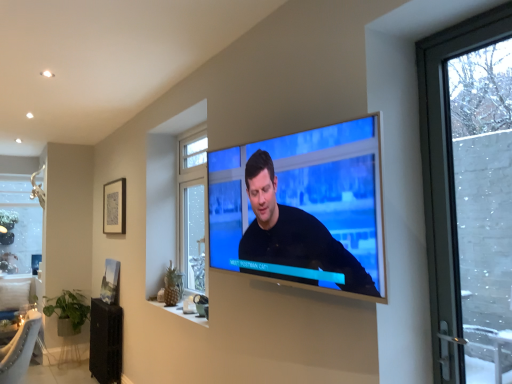
The height and width of the screenshot is (384, 512). What do you see at coordinates (110, 282) in the screenshot?
I see `matte black picture frame at lower left, which is the second picture frame from top to bottom` at bounding box center [110, 282].

Locate an element on the screen. Image resolution: width=512 pixels, height=384 pixels. clear glass window at upper left, which appears as the first window when viewed from the left is located at coordinates (19, 225).

Identify the location of matte black tv at center. The width and height of the screenshot is (512, 384). (302, 209).

What do you see at coordinates (114, 207) in the screenshot?
I see `matte black picture frame at upper left, which appears as the 2th picture frame when ordered from the bottom` at bounding box center [114, 207].

Identify the location of clear glass window at center, which is counted as the first window, starting from the front. (192, 209).

Can you confirm if clear glass window at upper left, which appears as the first window when viewed from the left, is shorter than matte black picture frame at lower left, which is the second picture frame from top to bottom?

Result: No.

Is matte black picture frame at lower left, which is the second picture frame from top to bottom, completely or partially inside clear glass window at upper left, which ranks as the 2th window in right-to-left order?

No, matte black picture frame at lower left, which is the second picture frame from top to bottom, is not inside clear glass window at upper left, which ranks as the 2th window in right-to-left order.

Is clear glass window at upper left, the first window when ordered from back to front, placed right next to matte black picture frame at lower left, which is the second picture frame from top to bottom?

clear glass window at upper left, the first window when ordered from back to front, is not next to matte black picture frame at lower left, which is the second picture frame from top to bottom, and they're not touching.

Where is `picture frame lying below the clear glass window at upper left, the 2th window from the front (from the image's perspective)`? Image resolution: width=512 pixels, height=384 pixels. picture frame lying below the clear glass window at upper left, the 2th window from the front (from the image's perspective) is located at coordinates (110, 282).

This screenshot has width=512, height=384. Identify the location of window on the left of the matte black picture frame at upper left, which is the 1th picture frame from top to bottom. (19, 225).

What's the angular difference between clear glass window at upper left, which ranks as the 2th window in right-to-left order, and matte black picture frame at upper left, which appears as the 2th picture frame when ordered from the bottom,'s facing directions?

The angle between the facing direction of clear glass window at upper left, which ranks as the 2th window in right-to-left order, and the facing direction of matte black picture frame at upper left, which appears as the 2th picture frame when ordered from the bottom, is 89.2 degrees.

From the picture: Is clear glass window at upper left, the 2th window from the front, at the right side of matte black picture frame at upper left, which appears as the 2th picture frame when ordered from the bottom?

Incorrect, clear glass window at upper left, the 2th window from the front, is not on the right side of matte black picture frame at upper left, which appears as the 2th picture frame when ordered from the bottom.

Considering the sizes of clear glass window at upper left, which ranks as the 2th window in right-to-left order, and matte black picture frame at upper left, which is the 1th picture frame from top to bottom, in the image, is clear glass window at upper left, which ranks as the 2th window in right-to-left order, wider or thinner than matte black picture frame at upper left, which is the 1th picture frame from top to bottom,?

clear glass window at upper left, which ranks as the 2th window in right-to-left order, is wider than matte black picture frame at upper left, which is the 1th picture frame from top to bottom.

Which is nearer, (22, 257) or (194, 215)?

Point (22, 257).

Is clear glass window at upper left, the first window when ordered from back to front, wider than clear glass window at center, which is counted as the first window, starting from the front?

No, clear glass window at upper left, the first window when ordered from back to front, is not wider than clear glass window at center, which is counted as the first window, starting from the front.

The width and height of the screenshot is (512, 384). I want to click on window lying in front of the clear glass window at upper left, the first window when ordered from back to front, so click(192, 209).

Is clear glass window at upper left, the 2th window from the front, facing away from clear glass window at center, marked as the 1th window in a right-to-left arrangement?

No, clear glass window at upper left, the 2th window from the front, is not facing the opposite direction of clear glass window at center, marked as the 1th window in a right-to-left arrangement.

Is clear glass window at center, marked as the 1th window in a right-to-left arrangement, positioned far away from clear glass window at upper left, which appears as the first window when viewed from the left?

clear glass window at center, marked as the 1th window in a right-to-left arrangement, is positioned a significant distance from clear glass window at upper left, which appears as the first window when viewed from the left.

Which is farther, (182, 163) or (33, 203)?

Point (33, 203)

From the image's perspective, is clear glass window at center, which is counted as the first window, starting from the front, located above or below clear glass window at upper left, which ranks as the 2th window in right-to-left order?

Based on their image positions, clear glass window at center, which is counted as the first window, starting from the front, is located above clear glass window at upper left, which ranks as the 2th window in right-to-left order.

Is clear glass window at center, positioned as the second window in back-to-front order, not inside clear glass window at upper left, the first window when ordered from back to front?

Yes.

From the image's perspective, is matte black picture frame at upper left, which is the 1th picture frame from top to bottom, located above or below clear glass window at upper left, the 2th window from the front?

matte black picture frame at upper left, which is the 1th picture frame from top to bottom, is situated higher than clear glass window at upper left, the 2th window from the front, in the image.

Which is more to the right, matte black picture frame at upper left, which appears as the 2th picture frame when ordered from the bottom, or clear glass window at upper left, which appears as the first window when viewed from the left?

Positioned to the right is matte black picture frame at upper left, which appears as the 2th picture frame when ordered from the bottom.

From a real-world perspective, which is physically above, matte black picture frame at upper left, which appears as the 2th picture frame when ordered from the bottom, or clear glass window at upper left, the 2th window from the front?

From a 3D spatial view, matte black picture frame at upper left, which appears as the 2th picture frame when ordered from the bottom, is above.

Measure the distance from matte black picture frame at upper left, which is the 1th picture frame from top to bottom, to clear glass window at upper left, the 2th window from the front.

The distance of matte black picture frame at upper left, which is the 1th picture frame from top to bottom, from clear glass window at upper left, the 2th window from the front, is 3.97 meters.

Can you confirm if matte black tv at center is thinner than matte black picture frame at lower left, which is the second picture frame from top to bottom?

Incorrect, the width of matte black tv at center is not less than that of matte black picture frame at lower left, which is the second picture frame from top to bottom.

Considering the relative sizes of matte black tv at center and matte black picture frame at lower left, which ranks as the 1th picture frame in bottom-to-top order, in the image provided, is matte black tv at center taller than matte black picture frame at lower left, which ranks as the 1th picture frame in bottom-to-top order,?

Yes.

Consider the image. From the image's perspective, is matte black tv at center located beneath matte black picture frame at lower left, which is the second picture frame from top to bottom?

No, from the image's perspective, matte black tv at center is not below matte black picture frame at lower left, which is the second picture frame from top to bottom.

Considering the positions of point (379, 173) and point (116, 297), is point (379, 173) closer or farther from the camera than point (116, 297)?

Point (379, 173).

Considering the sizes of objects matte black picture frame at lower left, which is the second picture frame from top to bottom, and clear glass window at center, which ranks as the 2th window in left-to-right order, in the image provided, who is bigger, matte black picture frame at lower left, which is the second picture frame from top to bottom, or clear glass window at center, which ranks as the 2th window in left-to-right order,?

clear glass window at center, which ranks as the 2th window in left-to-right order.

Considering the positions of points (115, 264) and (178, 251), is point (115, 264) farther from camera compared to point (178, 251)?

Yes, it is behind point (178, 251).

Choose the correct answer: Is matte black picture frame at lower left, which is the second picture frame from top to bottom, inside clear glass window at center, marked as the 1th window in a right-to-left arrangement, or outside it?

matte black picture frame at lower left, which is the second picture frame from top to bottom, is not inside clear glass window at center, marked as the 1th window in a right-to-left arrangement, it's outside.

Between matte black picture frame at lower left, which ranks as the 1th picture frame in bottom-to-top order, and clear glass window at center, marked as the 1th window in a right-to-left arrangement, which one is positioned behind?

matte black picture frame at lower left, which ranks as the 1th picture frame in bottom-to-top order, is behind.

From a real-world perspective, which window is the 1st one above the matte black picture frame at lower left, which ranks as the 1th picture frame in bottom-to-top order? Please provide its 2D coordinates.

[(19, 225)]

Locate an element on the screen. The height and width of the screenshot is (384, 512). the 2nd window located beneath the matte black picture frame at upper left, which is the 1th picture frame from top to bottom (from a real-world perspective) is located at coordinates (19, 225).

From the image, which object appears to be farther from matte black picture frame at lower left, which ranks as the 1th picture frame in bottom-to-top order, matte black picture frame at upper left, which is the 1th picture frame from top to bottom, or clear glass window at center, which ranks as the 2th window in left-to-right order?

Based on the image, clear glass window at center, which ranks as the 2th window in left-to-right order, appears to be further to matte black picture frame at lower left, which ranks as the 1th picture frame in bottom-to-top order.

When comparing their distances from matte black picture frame at upper left, which appears as the 2th picture frame when ordered from the bottom, does clear glass window at upper left, the 2th window from the front, or matte black picture frame at lower left, which is the second picture frame from top to bottom, seem further?

clear glass window at upper left, the 2th window from the front.

Which object lies nearer to the anchor point clear glass window at center, positioned as the second window in back-to-front order, matte black tv at center or matte black picture frame at upper left, which appears as the 2th picture frame when ordered from the bottom?

matte black picture frame at upper left, which appears as the 2th picture frame when ordered from the bottom.

Which object lies further to the anchor point matte black picture frame at lower left, which is the second picture frame from top to bottom, clear glass window at center, which ranks as the 2th window in left-to-right order, or matte black tv at center?

matte black tv at center lies further to matte black picture frame at lower left, which is the second picture frame from top to bottom, than the other object.

Based on their spatial positions, is matte black tv at center or clear glass window at center, positioned as the second window in back-to-front order, closer to matte black picture frame at lower left, which ranks as the 1th picture frame in bottom-to-top order?

clear glass window at center, positioned as the second window in back-to-front order, is closer to matte black picture frame at lower left, which ranks as the 1th picture frame in bottom-to-top order.

Looking at the image, which one is located further to clear glass window at center, which ranks as the 2th window in left-to-right order, matte black tv at center or matte black picture frame at lower left, which ranks as the 1th picture frame in bottom-to-top order?

Among the two, matte black tv at center is located further to clear glass window at center, which ranks as the 2th window in left-to-right order.

Which object lies nearer to the anchor point matte black tv at center, clear glass window at upper left, the 2th window from the front, or clear glass window at center, positioned as the second window in back-to-front order?

clear glass window at center, positioned as the second window in back-to-front order.

In the scene shown: Which object lies further to the anchor point clear glass window at center, marked as the 1th window in a right-to-left arrangement, matte black tv at center or clear glass window at upper left, the 2th window from the front?

clear glass window at upper left, the 2th window from the front, is further to clear glass window at center, marked as the 1th window in a right-to-left arrangement.

I want to click on picture frame between clear glass window at upper left, which ranks as the 2th window in right-to-left order, and matte black picture frame at upper left, which is the 1th picture frame from top to bottom, in the horizontal direction, so click(x=110, y=282).

Where is `window between matte black tv at center and matte black picture frame at upper left, which is the 1th picture frame from top to bottom, along the z-axis`? The image size is (512, 384). window between matte black tv at center and matte black picture frame at upper left, which is the 1th picture frame from top to bottom, along the z-axis is located at coordinates (192, 209).

Locate an element on the screen. The image size is (512, 384). window between matte black tv at center and clear glass window at upper left, the first window when ordered from back to front, along the z-axis is located at coordinates (192, 209).

This screenshot has height=384, width=512. I want to click on window between matte black tv at center and matte black picture frame at lower left, which ranks as the 1th picture frame in bottom-to-top order, in the front-back direction, so click(192, 209).